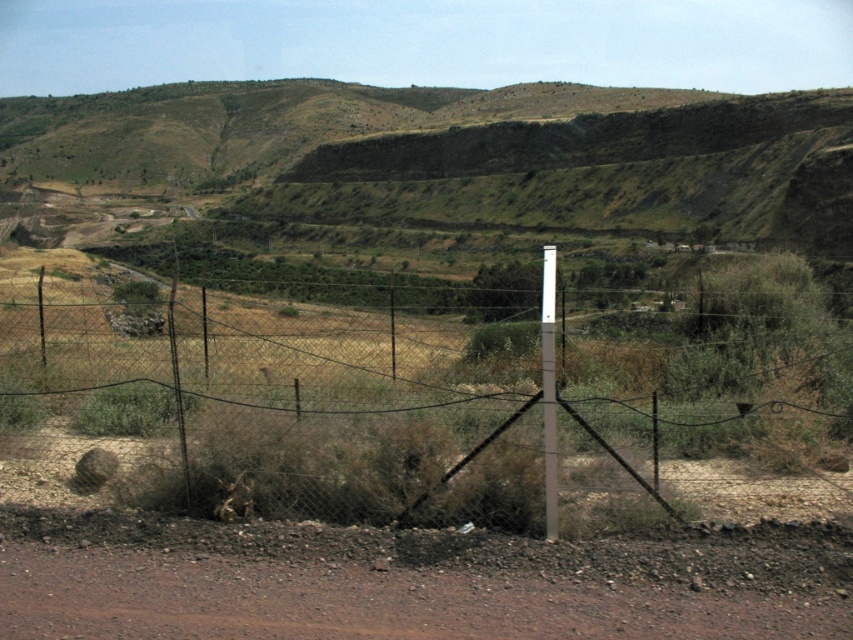
Question: Does wire mesh fence at center appear over brown gravel dirt track at lower center?

Choices:
 (A) yes
 (B) no

Answer: (A)

Question: Is wire mesh fence at center positioned before brown gravel dirt track at lower center?

Choices:
 (A) yes
 (B) no

Answer: (B)

Question: Which point is closer to the camera taking this photo?

Choices:
 (A) (550, 332)
 (B) (338, 582)

Answer: (B)

Question: Which point is closer to the camera taking this photo?

Choices:
 (A) click(x=548, y=499)
 (B) click(x=381, y=161)

Answer: (A)

Question: Among these points, which one is farthest from the camera?

Choices:
 (A) (x=550, y=332)
 (B) (x=505, y=579)
 (C) (x=509, y=458)

Answer: (C)

Question: Does wire mesh fence at center have a smaller size compared to metallic gray pole at center?

Choices:
 (A) no
 (B) yes

Answer: (A)